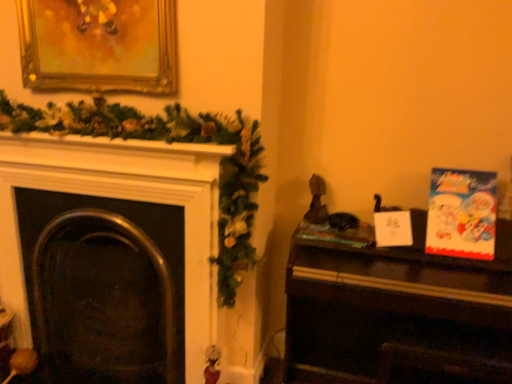
You are a GUI agent. You are given a task and a screenshot of the screen. Output one action in this format:
    pyautogui.click(x=<x>, y=<y>)
    Task: Click on the metallic dark fireplace at left
    This screenshot has height=384, width=512.
    Given the screenshot: What is the action you would take?
    pyautogui.click(x=121, y=198)

What do you see at coordinates (398, 315) in the screenshot? This screenshot has width=512, height=384. I see `wooden piano at right` at bounding box center [398, 315].

This screenshot has width=512, height=384. Describe the element at coordinates (338, 234) in the screenshot. I see `hardcover book at center-right` at that location.

Where is `gold ornate picture frame at upper left`? The image size is (512, 384). gold ornate picture frame at upper left is located at coordinates (99, 45).

Find the location of a particular element. metallic dark fireplace at left is located at coordinates (121, 198).

Image resolution: width=512 pixels, height=384 pixels. I want to click on fireplace positioned vertically above the wooden piano at right (from a real-world perspective), so click(x=121, y=198).

Is wooden piano at right wider or thinner than metallic dark fireplace at left?

In the image, wooden piano at right appears to be wider than metallic dark fireplace at left.

Consider the image. From the image's perspective, relative to metallic dark fireplace at left, is wooden piano at right above or below?

wooden piano at right is situated lower than metallic dark fireplace at left in the image.

Is wooden piano at right facing towards metallic dark fireplace at left?

No, wooden piano at right is not oriented towards metallic dark fireplace at left.

Consider the image. Which object is wider, hardcover book at center-right or gold ornate picture frame at upper left?

Wider between the two is hardcover book at center-right.

Between hardcover book at center-right and gold ornate picture frame at upper left, which one is positioned behind?

hardcover book at center-right is behind.

The height and width of the screenshot is (384, 512). Identify the location of book below the gold ornate picture frame at upper left (from a real-world perspective). (338, 234).

From the image's perspective, which one is positioned higher, hardcover book at center-right or gold ornate picture frame at upper left?

gold ornate picture frame at upper left, from the image's perspective.

Who is bigger, gold ornate picture frame at upper left or cartoon paper christmas card at right?

gold ornate picture frame at upper left is bigger.

From a real-world perspective, relative to cartoon paper christmas card at right, is gold ornate picture frame at upper left vertically above or below?

Clearly, from a real-world perspective, gold ornate picture frame at upper left is above cartoon paper christmas card at right.

Would you say gold ornate picture frame at upper left is a long distance from cartoon paper christmas card at right?

gold ornate picture frame at upper left is positioned a significant distance from cartoon paper christmas card at right.

Based on the photo, can you confirm if gold ornate picture frame at upper left is positioned to the left of cartoon paper christmas card at right?

Yes.

Measure the distance from cartoon paper christmas card at right to metallic dark fireplace at left.

They are 1.14 meters apart.

How different are the orientations of cartoon paper christmas card at right and metallic dark fireplace at left in degrees?

The angular difference between cartoon paper christmas card at right and metallic dark fireplace at left is 1.69 degrees.

Is cartoon paper christmas card at right looking in the opposite direction of metallic dark fireplace at left?

That's not correct — cartoon paper christmas card at right is not looking away from metallic dark fireplace at left.

Between cartoon paper christmas card at right and metallic dark fireplace at left, which one has larger width?

Wider between the two is metallic dark fireplace at left.

Is gold ornate picture frame at upper left inside or outside of hardcover book at center-right?

gold ornate picture frame at upper left lies outside hardcover book at center-right.

How many degrees apart are the facing directions of gold ornate picture frame at upper left and hardcover book at center-right?

The angle between the facing direction of gold ornate picture frame at upper left and the facing direction of hardcover book at center-right is 0.304 degrees.

From the image's perspective, is gold ornate picture frame at upper left above or below hardcover book at center-right?

Based on their image positions, gold ornate picture frame at upper left is located above hardcover book at center-right.

Looking at this image, from a real-world perspective, is gold ornate picture frame at upper left above or below hardcover book at center-right?

gold ornate picture frame at upper left is above hardcover book at center-right.

Between hardcover book at center-right and cartoon paper christmas card at right, which one is positioned in front?

cartoon paper christmas card at right is closer to the camera.

In terms of width, does hardcover book at center-right look wider or thinner when compared to cartoon paper christmas card at right?

In the image, hardcover book at center-right appears to be wider than cartoon paper christmas card at right.

Is hardcover book at center-right aimed at cartoon paper christmas card at right?

No, hardcover book at center-right is not aimed at cartoon paper christmas card at right.

Where is `book to the left of cartoon paper christmas card at right`? book to the left of cartoon paper christmas card at right is located at coordinates (338, 234).

From a real-world perspective, between cartoon paper christmas card at right and gold ornate picture frame at upper left, who is vertically higher?

gold ornate picture frame at upper left.

Identify the location of christmas card on the right of gold ornate picture frame at upper left. The height and width of the screenshot is (384, 512). (462, 214).

Is cartoon paper christmas card at right looking in the opposite direction of gold ornate picture frame at upper left?

That's not correct — cartoon paper christmas card at right is not looking away from gold ornate picture frame at upper left.

Is point (448, 218) farther from viewer compared to point (70, 7)?

That is False.

Identify the location of table located on the right of metallic dark fireplace at left. Image resolution: width=512 pixels, height=384 pixels. (398, 315).

At what (x,y) coordinates should I click in order to perform the action: click on picture frame in front of the hardcover book at center-right. Please return your answer as a coordinate pair (x, y). The image size is (512, 384). Looking at the image, I should click on (99, 45).

Which object lies nearer to the anchor point gold ornate picture frame at upper left, hardcover book at center-right or cartoon paper christmas card at right?

Among the two, hardcover book at center-right is located nearer to gold ornate picture frame at upper left.

Looking at the image, which one is located further to hardcover book at center-right, wooden piano at right or metallic dark fireplace at left?

metallic dark fireplace at left lies further to hardcover book at center-right than the other object.

Looking at this image, looking at the image, which one is located further to gold ornate picture frame at upper left, metallic dark fireplace at left or hardcover book at center-right?

hardcover book at center-right lies further to gold ornate picture frame at upper left than the other object.

Based on their spatial positions, is metallic dark fireplace at left or wooden piano at right further from cartoon paper christmas card at right?

metallic dark fireplace at left lies further to cartoon paper christmas card at right than the other object.

In the scene shown: From the image, which object appears to be farther from cartoon paper christmas card at right, metallic dark fireplace at left or hardcover book at center-right?

metallic dark fireplace at left is positioned further to the anchor cartoon paper christmas card at right.

Considering their positions, is hardcover book at center-right positioned closer to wooden piano at right than gold ornate picture frame at upper left?

Based on the image, hardcover book at center-right appears to be nearer to wooden piano at right.

Which object lies nearer to the anchor point metallic dark fireplace at left, wooden piano at right or cartoon paper christmas card at right?

wooden piano at right.

When comparing their distances from hardcover book at center-right, does wooden piano at right or gold ornate picture frame at upper left seem further?

gold ornate picture frame at upper left lies further to hardcover book at center-right than the other object.

Where is `picture frame located between metallic dark fireplace at left and cartoon paper christmas card at right in the left-right direction`? The height and width of the screenshot is (384, 512). picture frame located between metallic dark fireplace at left and cartoon paper christmas card at right in the left-right direction is located at coordinates (99, 45).

Find the location of a particular element. This screenshot has width=512, height=384. book between metallic dark fireplace at left and cartoon paper christmas card at right in the horizontal direction is located at coordinates (338, 234).

Find the location of a particular element. picture frame between metallic dark fireplace at left and wooden piano at right is located at coordinates (99, 45).

The width and height of the screenshot is (512, 384). Find the location of `picture frame situated between metallic dark fireplace at left and hardcover book at center-right from left to right`. picture frame situated between metallic dark fireplace at left and hardcover book at center-right from left to right is located at coordinates (99, 45).